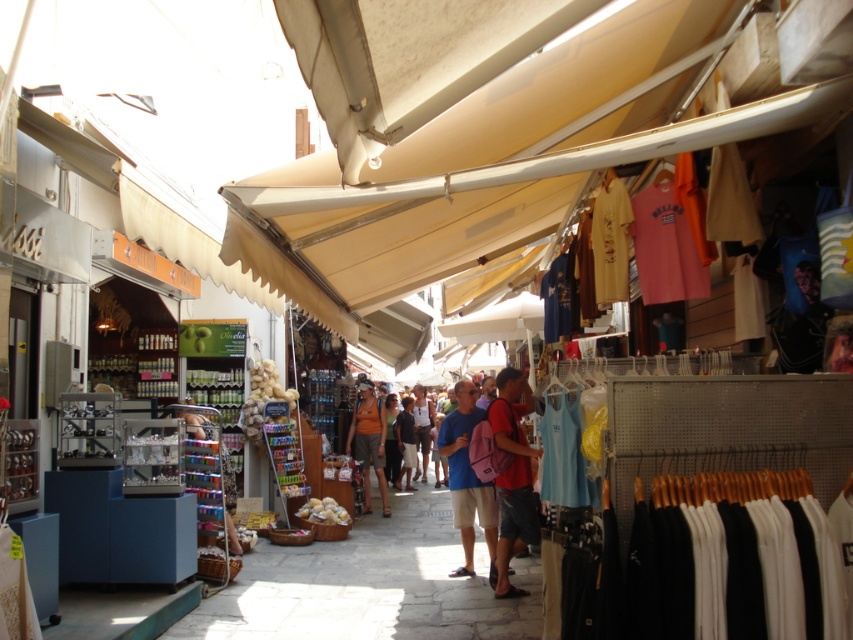
You are a shopper standing at the entrance of the market and want to pick up both the matte red backpack at center and the matte white shirt at center. Which item should you grab first if you want to start with the one on your right?

The matte red backpack at center is positioned on the right side of the matte white shirt at center, so you should grab the matte red backpack at center first since it is on your right.